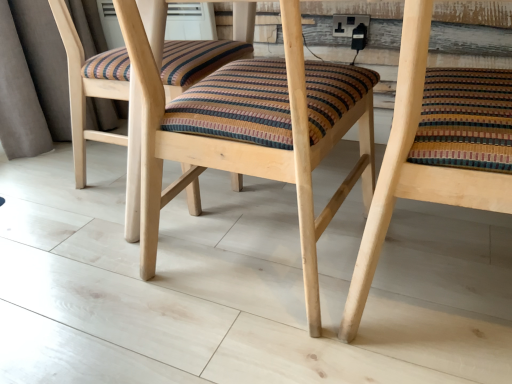
Where is `vacant area situated below wooden chair at center, the second chair positioned from the right (from a real-world perspective)`? The width and height of the screenshot is (512, 384). vacant area situated below wooden chair at center, the second chair positioned from the right (from a real-world perspective) is located at coordinates (253, 247).